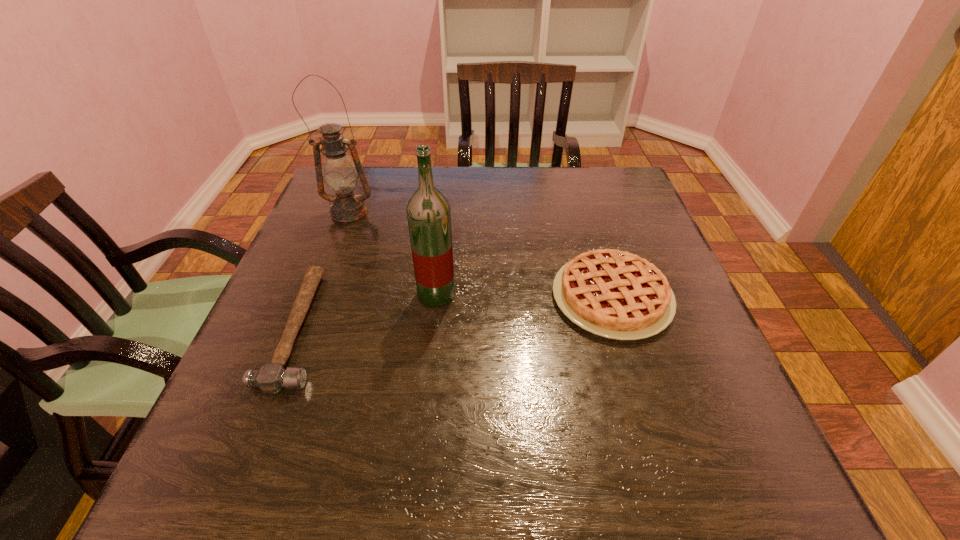
I want to click on the farthest object, so click(x=340, y=175).

You are a GUI agent. You are given a task and a screenshot of the screen. Output one action in this format:
    pyautogui.click(x=<x>, y=<y>)
    Task: Click on the second object from right to left
    
    Given the screenshot: What is the action you would take?
    pyautogui.click(x=428, y=211)

At what (x,y) coordinates should I click in order to perform the action: click on pie. Please return your answer as a coordinate pair (x, y). Looking at the image, I should click on (615, 294).

This screenshot has width=960, height=540. I want to click on the third tallest object, so click(615, 294).

The width and height of the screenshot is (960, 540). Identify the location of hammer. (271, 378).

What are the coordinates of `blank area located 0.080m on the back of the oil lamp` in the screenshot? It's located at (359, 186).

What are the coordinates of `vacant space situated 0.270m on the left of the liquor` in the screenshot? It's located at (292, 294).

The width and height of the screenshot is (960, 540). In order to click on free point located 0.240m on the left of the pie in this screenshot , I will do `click(440, 297)`.

Identify the location of blank area located 0.350m on the striking face of the shortest object. (501, 328).

Identify the location of object that is at the far edge. (340, 175).